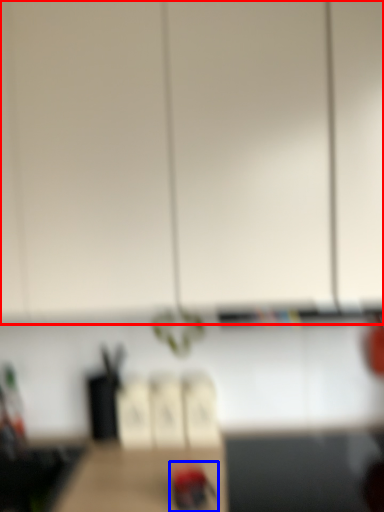
Question: Which object is further to the camera taking this photo, cabinetry (highlighted by a red box) or woodpecker (highlighted by a blue box)?

Choices:
 (A) cabinetry
 (B) woodpecker

Answer: (B)